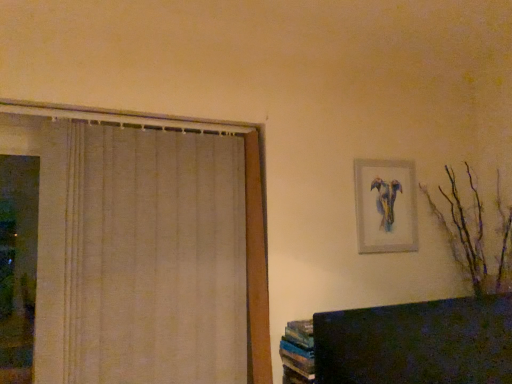
The image size is (512, 384). Describe the element at coordinates (475, 236) in the screenshot. I see `brown matte branches at right` at that location.

Image resolution: width=512 pixels, height=384 pixels. I want to click on brown matte branches at right, so click(x=475, y=236).

Are beige fabric curtain at left and brown matte branches at right located far from each other?

beige fabric curtain at left is far away from brown matte branches at right.

Between point (173, 324) and point (477, 222), which one is positioned in front?

The point (173, 324) is closer to the camera.

Image resolution: width=512 pixels, height=384 pixels. In order to click on branch that is under the beige fabric curtain at left (from a real-world perspective) in this screenshot , I will do `click(475, 236)`.

Between point (500, 285) and point (368, 184), which one is positioned in front?

The point (368, 184) is more forward.

Would you say brown matte branches at right is a long distance from matte silver picture frame at upper right?

No, brown matte branches at right is in close proximity to matte silver picture frame at upper right.

Is brown matte branches at right not inside matte silver picture frame at upper right?

Yes, brown matte branches at right is located beyond the bounds of matte silver picture frame at upper right.

Would you say matte silver picture frame at upper right contains brown matte branches at right?

No.

Is matte silver picture frame at upper right oriented away from brown matte branches at right?

That's not correct — matte silver picture frame at upper right is not looking away from brown matte branches at right.

How many degrees apart are the facing directions of matte silver picture frame at upper right and brown matte branches at right?

The angle between the facing direction of matte silver picture frame at upper right and the facing direction of brown matte branches at right is 1.32 degrees.

Considering the relative positions of matte silver picture frame at upper right and brown matte branches at right in the image provided, is matte silver picture frame at upper right to the right of brown matte branches at right from the viewer's perspective?

In fact, matte silver picture frame at upper right is to the left of brown matte branches at right.

Image resolution: width=512 pixels, height=384 pixels. Find the location of `curtain on the left of brown matte branches at right`. curtain on the left of brown matte branches at right is located at coordinates (140, 258).

Is brown matte branches at right positioned with its back to beige fabric curtain at left?

That's not correct — brown matte branches at right is not looking away from beige fabric curtain at left.

Between beige fabric curtain at left and matte silver picture frame at upper right, which one has larger width?

Wider between the two is beige fabric curtain at left.

From a real-world perspective, is beige fabric curtain at left physically above matte silver picture frame at upper right?

No, from a real-world perspective, beige fabric curtain at left is not over matte silver picture frame at upper right

Which of these two, beige fabric curtain at left or matte silver picture frame at upper right, stands shorter?

matte silver picture frame at upper right is shorter.

In the scene shown: Is beige fabric curtain at left positioned far away from matte silver picture frame at upper right?

beige fabric curtain at left is near matte silver picture frame at upper right, not far away.

Does matte silver picture frame at upper right touch beige fabric curtain at left?

matte silver picture frame at upper right is not next to beige fabric curtain at left, and they're not touching.

Which is behind, point (362, 211) or point (195, 139)?

The point (362, 211) is farther.

Which of these two, matte silver picture frame at upper right or beige fabric curtain at left, is bigger?

Bigger between the two is beige fabric curtain at left.

Locate an element on the screen. curtain above the brown matte branches at right (from the image's perspective) is located at coordinates (140, 258).

I want to click on branch on the right of the matte silver picture frame at upper right, so click(475, 236).

Looking at the image, which one is located closer to beige fabric curtain at left, matte silver picture frame at upper right or brown matte branches at right?

Among the two, matte silver picture frame at upper right is located nearer to beige fabric curtain at left.

Which object lies further to the anchor point matte silver picture frame at upper right, brown matte branches at right or beige fabric curtain at left?

The object further to matte silver picture frame at upper right is beige fabric curtain at left.

Considering their positions, is beige fabric curtain at left positioned further to brown matte branches at right than matte silver picture frame at upper right?

The object further to brown matte branches at right is beige fabric curtain at left.

When comparing their distances from beige fabric curtain at left, does brown matte branches at right or matte silver picture frame at upper right seem closer?

The object closer to beige fabric curtain at left is matte silver picture frame at upper right.

Which object lies further to the anchor point brown matte branches at right, matte silver picture frame at upper right or beige fabric curtain at left?

The object further to brown matte branches at right is beige fabric curtain at left.

Which object lies nearer to the anchor point matte silver picture frame at upper right, beige fabric curtain at left or brown matte branches at right?

brown matte branches at right.

Identify the location of picture frame located between beige fabric curtain at left and brown matte branches at right in the left-right direction. This screenshot has width=512, height=384. (385, 206).